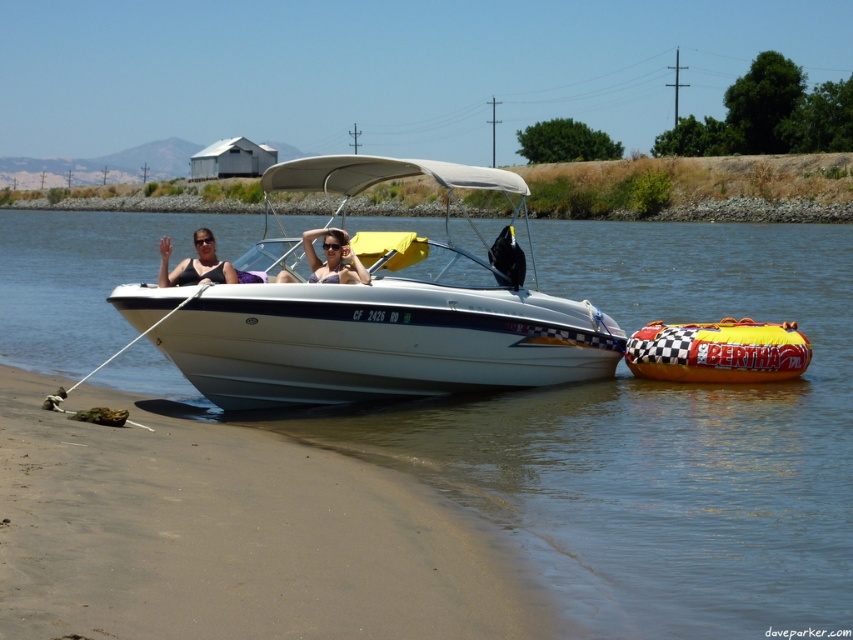
You are a photographer trying to capture the reflection of the white glossy boat at center in the water. Based on the scene, is the white glossy water at center positioned in a way that it can reflect the boat?

Yes, the white glossy water at center is positioned below the white glossy boat at center, which means it can reflect the boat.

You are standing on the sandy brown at lower left and want to reach the yellow checkered tube at lower right. Which direction should you move to get closer to the tube?

The yellow checkered tube at lower right is taller than the sandy brown at lower left. Since you are on the sandy brown at lower left, you should move towards the right direction to get closer to the yellow checkered tube at lower right.

You are a photographer trying to capture the white glossy boat at center and the sandy brown at lower left in the same frame. Based on their heights, which object should you focus on first to ensure both are in the shot?

Since the sandy brown at lower left is shorter than the white glossy boat at center, you should focus on the white glossy boat at center first to ensure both are in the shot.